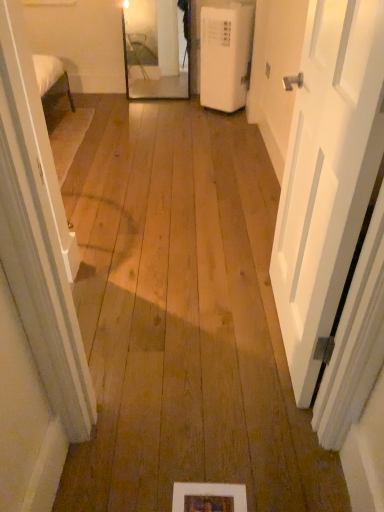
Question: From a real-world perspective, is white plastic air conditioner at right on wooden picture frame at lower center?

Choices:
 (A) no
 (B) yes

Answer: (B)

Question: From the image's perspective, does white plastic air conditioner at right appear lower than wooden picture frame at lower center?

Choices:
 (A) yes
 (B) no

Answer: (B)

Question: Can you confirm if white plastic air conditioner at right is thinner than wooden picture frame at lower center?

Choices:
 (A) yes
 (B) no

Answer: (B)

Question: Is the position of white plastic air conditioner at right less distant than that of wooden picture frame at lower center?

Choices:
 (A) yes
 (B) no

Answer: (B)

Question: Does white plastic air conditioner at right have a smaller size compared to wooden picture frame at lower center?

Choices:
 (A) yes
 (B) no

Answer: (B)

Question: From the image's perspective, is wooden picture frame at lower center positioned above or below white matte door at right?

Choices:
 (A) below
 (B) above

Answer: (A)

Question: Considering the positions of point (218, 500) and point (347, 199), is point (218, 500) closer or farther from the camera than point (347, 199)?

Choices:
 (A) farther
 (B) closer

Answer: (A)

Question: Considering the positions of wooden picture frame at lower center and white matte door at right in the image, is wooden picture frame at lower center taller or shorter than white matte door at right?

Choices:
 (A) short
 (B) tall

Answer: (A)

Question: Based on their sizes in the image, would you say wooden picture frame at lower center is bigger or smaller than white matte door at right?

Choices:
 (A) big
 (B) small

Answer: (B)

Question: Considering the positions of white plastic air conditioner at right and white matte door at right in the image, is white plastic air conditioner at right taller or shorter than white matte door at right?

Choices:
 (A) short
 (B) tall

Answer: (A)

Question: Considering the relative positions of white plastic air conditioner at right and white matte door at right in the image provided, is white plastic air conditioner at right to the left or to the right of white matte door at right?

Choices:
 (A) right
 (B) left

Answer: (B)

Question: In the image, is white plastic air conditioner at right positioned in front of or behind white matte door at right?

Choices:
 (A) behind
 (B) front

Answer: (A)

Question: From the image's perspective, relative to white matte door at right, is white plastic air conditioner at right above or below?

Choices:
 (A) above
 (B) below

Answer: (A)

Question: Considering the positions of white plastic air conditioner at right and wooden picture frame at lower center in the image, is white plastic air conditioner at right bigger or smaller than wooden picture frame at lower center?

Choices:
 (A) small
 (B) big

Answer: (B)

Question: From their relative heights in the image, would you say white plastic air conditioner at right is taller or shorter than wooden picture frame at lower center?

Choices:
 (A) tall
 (B) short

Answer: (A)